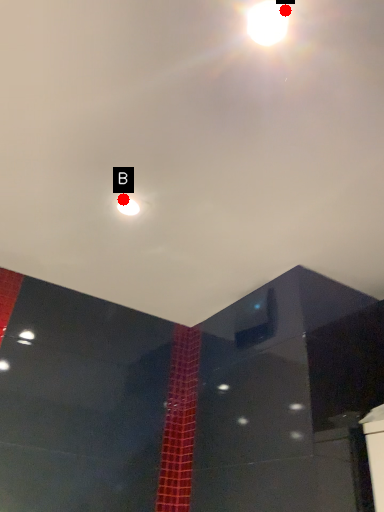
Question: Two points are circled on the image, labeled by A and B beside each circle. Which point appears farthest from the camera in this image?

Choices:
 (A) A is further
 (B) B is further

Answer: (B)